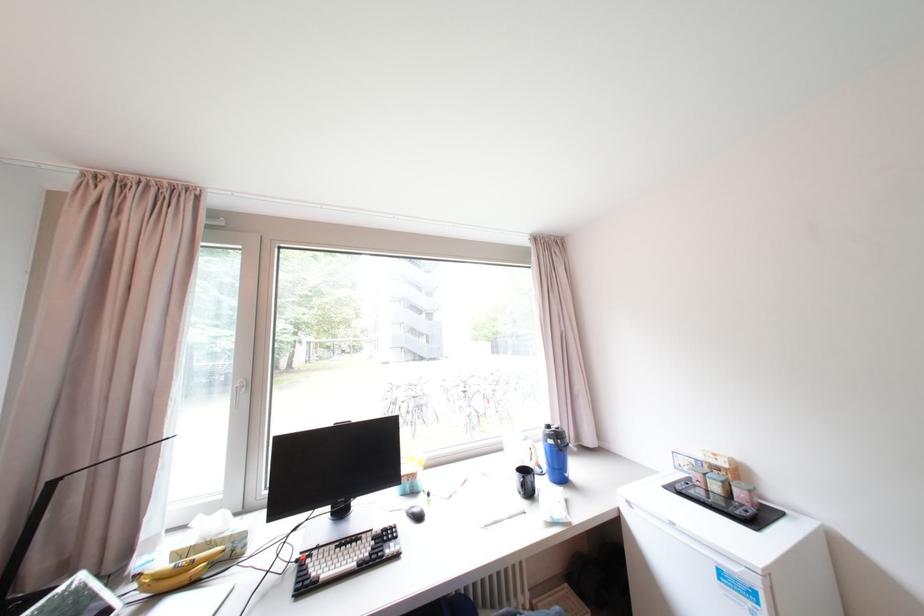
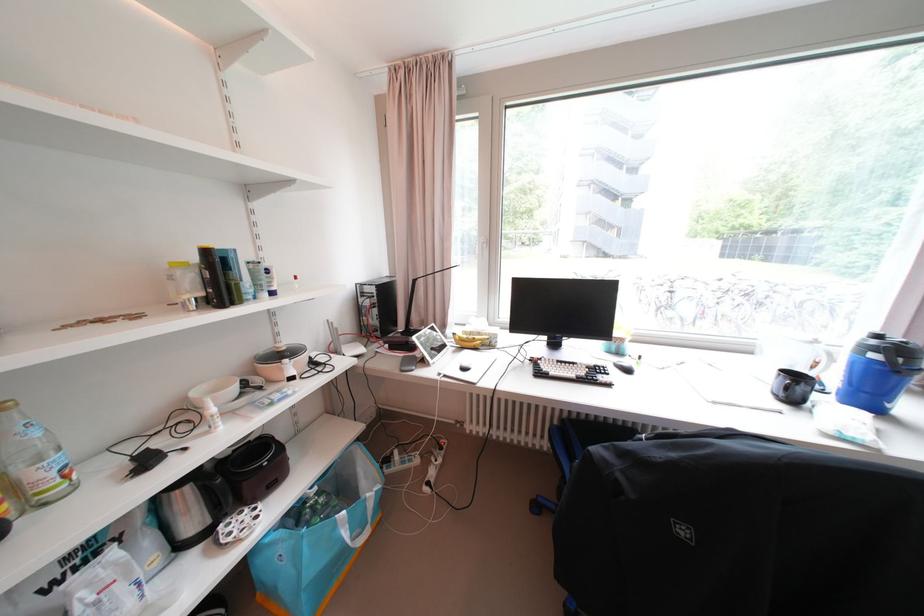
Locate, in the second image, the point that corresponds to (x=341, y=515) in the first image.

(555, 346)